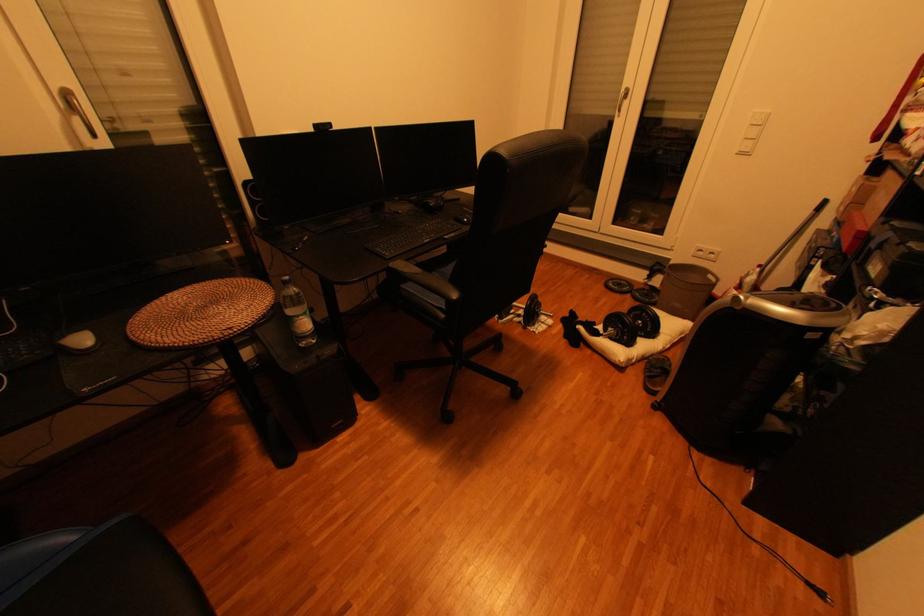
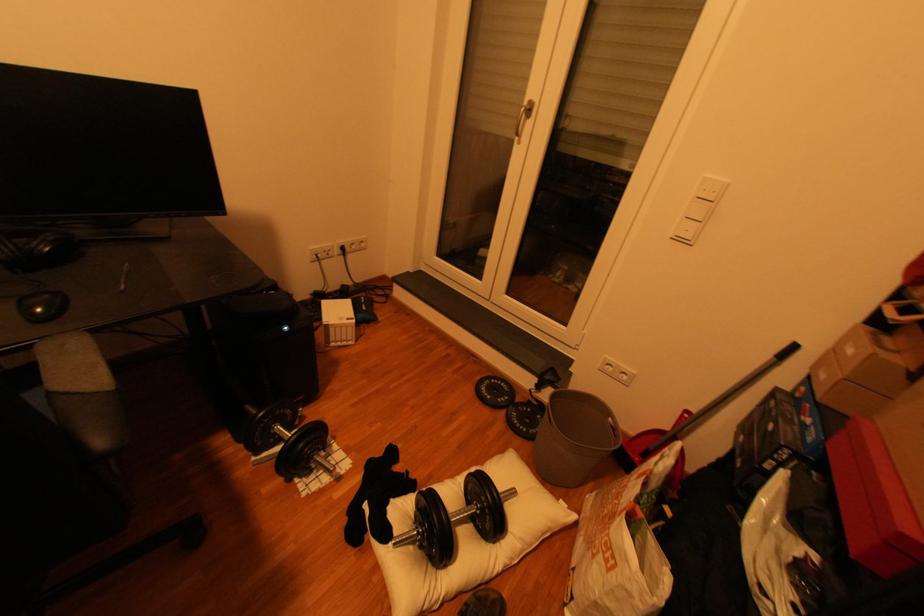
The point at (475, 221) is marked in the first image. Where is the corresponding point in the second image?

(47, 310)